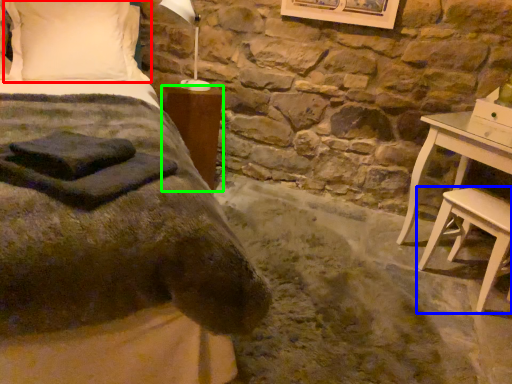
Question: Which is farther away from pillow (highlighted by a red box)? stool (highlighted by a blue box) or nightstand (highlighted by a green box)?

Choices:
 (A) stool
 (B) nightstand

Answer: (A)